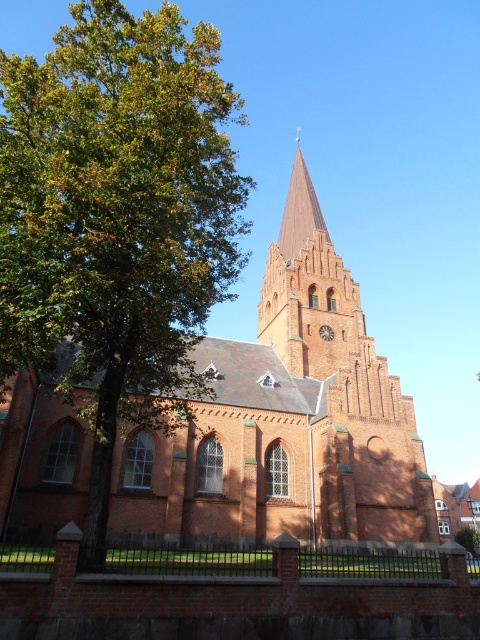
You are a painter standing at the front of the red brick church at center. You want to paint the brick clock at center first. Which object should you look up to paint first?

The brick clock at center is located on the tower of the red brick church at center. Since the clock is part of the church structure, you would need to look up at the red brick church at center to paint the brick clock at center.

You are standing in front of the red brick church at center and want to look up at the brick clock at center. Which direction should you move your eyes?

The red brick church at center is located below the brick clock at center, so you should look upward to see the brick clock at center.

You are standing in front of the church and want to take a photo that includes both the green leafy tree at left and the brick clock at center. Which object should you ensure is closer to the camera to include both in the frame?

The green leafy tree at left is bigger than the brick clock at center, so to include both in the frame, you should ensure the brick clock at center is closer to the camera.